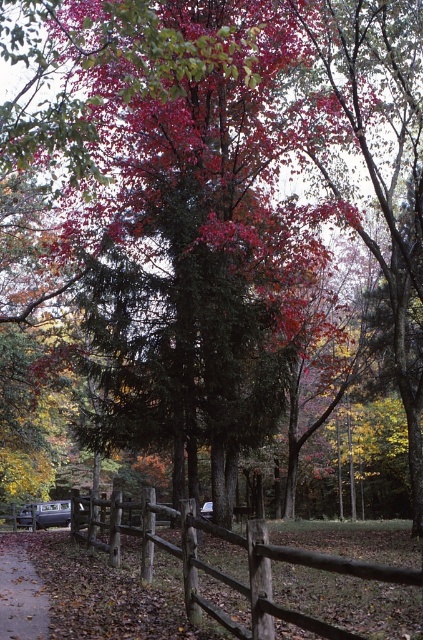
Based on the photo, you are a pedestrian standing on the paved path and want to see the metallic silver car at lower left. Which direction should you look relative to the brown wooden fence at lower center?

The brown wooden fence at lower center is located above the metallic silver car at lower left, so you should look downward below the brown wooden fence at lower center to see the metallic silver car at lower left.

You are a hiker who wants to take a photo of the brown wooden fence at lower center and the brown wooden path at lower left. Since you want both objects in focus, which one should you position closer to the camera to ensure both are in focus?

The brown wooden fence at lower center is closer to the viewer than the brown wooden path at lower left. To ensure both are in focus, you should position the camera closer to the fence so that the path is within the depth of field range.